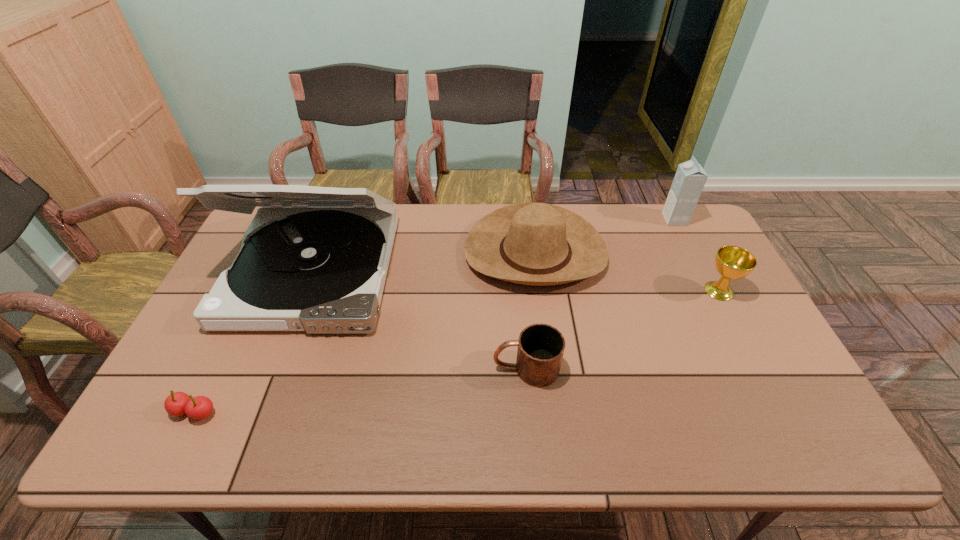
Find the location of a particular element. The height and width of the screenshot is (540, 960). vacant region located 0.380m on the front label of the carton is located at coordinates (559, 219).

Where is `vacant space located on the front label of the carton`? This screenshot has height=540, width=960. vacant space located on the front label of the carton is located at coordinates (592, 219).

Identify the location of free point located on the front-facing side of the cowboy hat. This screenshot has height=540, width=960. (552, 385).

Find the location of a particular element. Image resolution: width=960 pixels, height=540 pixels. free space located 0.060m on the left of the third shortest object is located at coordinates (682, 291).

Locate an element on the screen. vacant space situated on the side of the fifth tallest object with the handle is located at coordinates (377, 368).

Identify the location of free space located 0.250m on the side of the fifth tallest object with the handle. (396, 368).

Locate an element on the screen. The width and height of the screenshot is (960, 540). free space located 0.060m on the side of the fifth tallest object with the handle is located at coordinates (469, 368).

Locate an element on the screen. Image resolution: width=960 pixels, height=540 pixels. free space located 0.050m on the left of the shortest object is located at coordinates (150, 411).

The width and height of the screenshot is (960, 540). I want to click on CD player situated at the far edge, so click(x=315, y=259).

At what (x,y) coordinates should I click in order to perform the action: click on carton at the far edge. Please return your answer as a coordinate pair (x, y). Looking at the image, I should click on (690, 178).